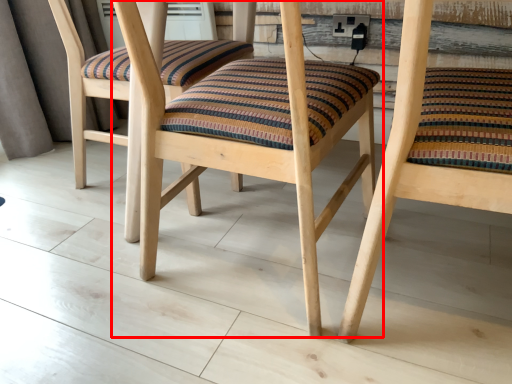
Question: From the image's perspective, what is the correct spatial positioning of chair (annotated by the red box) in reference to chair?

Choices:
 (A) above
 (B) below

Answer: (A)